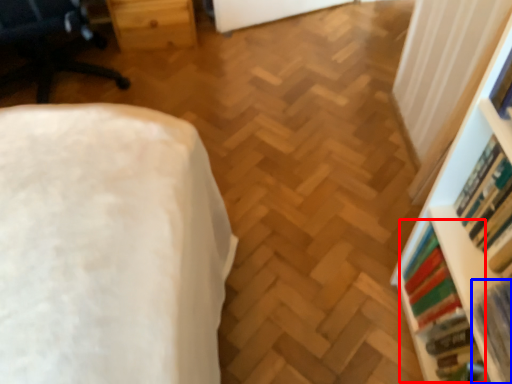
Question: Which of the following is the closest to the observer, book (highlighted by a red box) or book (highlighted by a blue box)?

Choices:
 (A) book
 (B) book

Answer: (B)